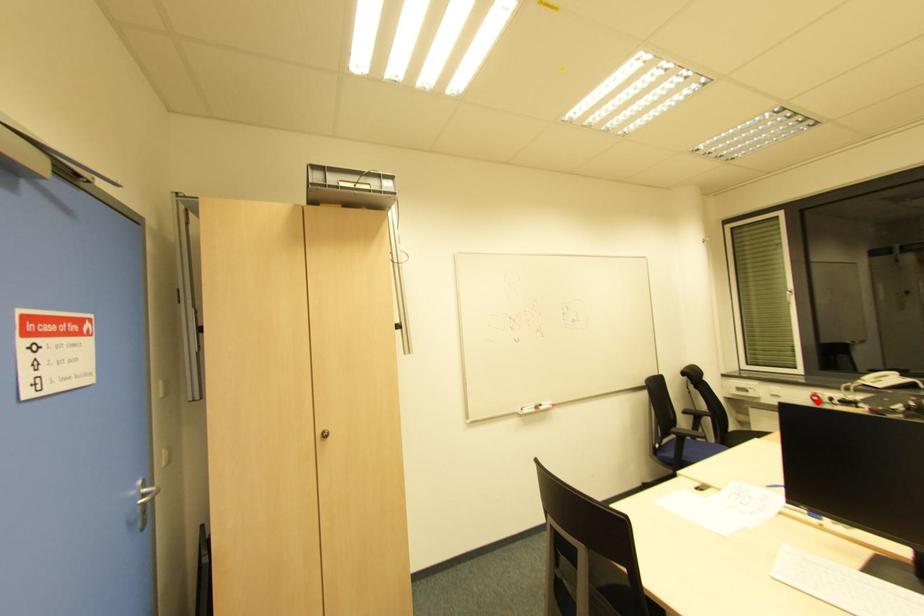
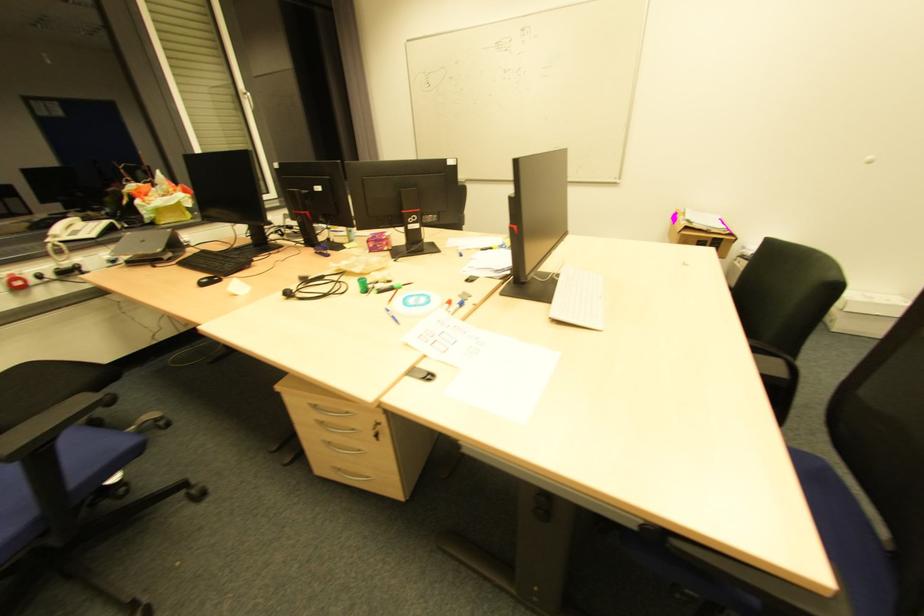
Question: I am providing you with two images of the same scene from different viewpoints. In image1, a red point is highlighted. Considering the same 3D point in image2, which of the following is correct?

Choices:
 (A) It is closer
 (B) It is farther

Answer: (B)